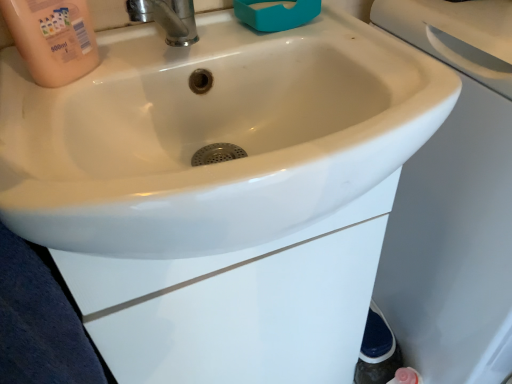
Question: Can you confirm if polished chrome tap at upper center is positioned to the right of white glossy sink at center?

Choices:
 (A) no
 (B) yes

Answer: (A)

Question: From the image's perspective, is polished chrome tap at upper center below white glossy sink at center?

Choices:
 (A) yes
 (B) no

Answer: (B)

Question: Considering the relative sizes of polished chrome tap at upper center and white glossy sink at center in the image provided, is polished chrome tap at upper center bigger than white glossy sink at center?

Choices:
 (A) yes
 (B) no

Answer: (B)

Question: Does polished chrome tap at upper center touch white glossy sink at center?

Choices:
 (A) no
 (B) yes

Answer: (A)

Question: Is polished chrome tap at upper center in front of white glossy sink at center?

Choices:
 (A) yes
 (B) no

Answer: (B)

Question: Is white glossy sink at center wider or thinner than pink matte bottle at upper left?

Choices:
 (A) thin
 (B) wide

Answer: (B)

Question: Does point (225, 162) appear closer or farther from the camera than point (14, 19)?

Choices:
 (A) closer
 (B) farther

Answer: (A)

Question: Which is correct: white glossy sink at center is inside pink matte bottle at upper left, or outside of it?

Choices:
 (A) inside
 (B) outside

Answer: (B)

Question: From the image's perspective, is white glossy sink at center above or below pink matte bottle at upper left?

Choices:
 (A) above
 (B) below

Answer: (B)

Question: From the image's perspective, relative to polished chrome tap at upper center, is pink matte bottle at upper left above or below?

Choices:
 (A) above
 (B) below

Answer: (B)

Question: Would you say pink matte bottle at upper left is inside or outside polished chrome tap at upper center?

Choices:
 (A) inside
 (B) outside

Answer: (B)

Question: Is point (31, 54) closer or farther from the camera than point (178, 43)?

Choices:
 (A) closer
 (B) farther

Answer: (A)

Question: Considering the positions of pink matte bottle at upper left and polished chrome tap at upper center in the image, is pink matte bottle at upper left taller or shorter than polished chrome tap at upper center?

Choices:
 (A) short
 (B) tall

Answer: (B)

Question: In terms of height, does pink matte bottle at upper left look taller or shorter compared to white glossy sink at center?

Choices:
 (A) tall
 (B) short

Answer: (B)

Question: Does point (4, 8) appear closer or farther from the camera than point (396, 87)?

Choices:
 (A) farther
 (B) closer

Answer: (B)